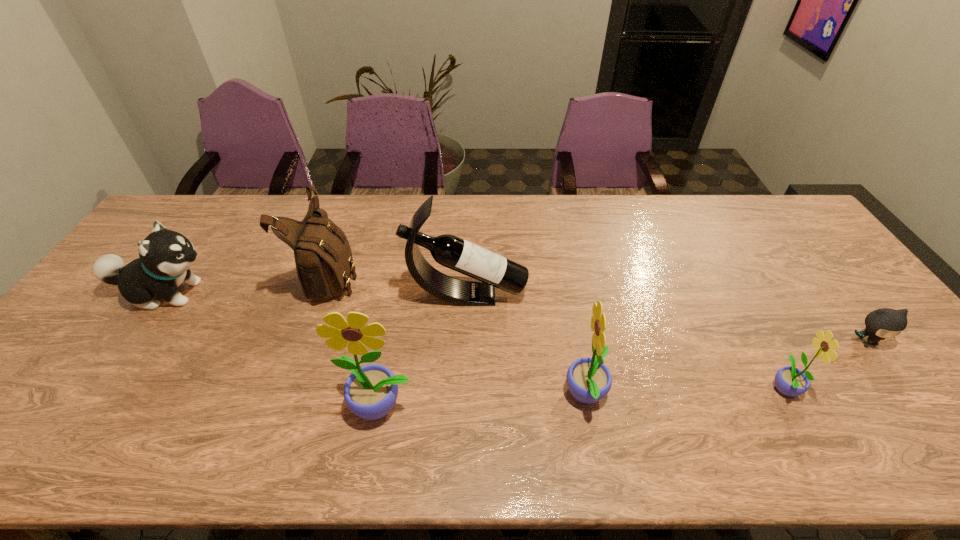
The image size is (960, 540). I want to click on free space between the leftmost object and the leftmost sunflower, so (275, 349).

Image resolution: width=960 pixels, height=540 pixels. I want to click on free space between the second object from left to right and the second shortest sunflower, so click(x=459, y=335).

This screenshot has width=960, height=540. Find the location of `the second closest object to the sixth object from left to right`. the second closest object to the sixth object from left to right is located at coordinates (589, 380).

Image resolution: width=960 pixels, height=540 pixels. I want to click on object that stands as the closest to the leftmost object, so click(x=323, y=257).

In order to click on sunflower that is the third closest to the sixth object from right to left in this screenshot , I will do `click(789, 380)`.

In order to click on sunflower that is the second closest to the leftmost object in this screenshot , I will do (589, 380).

This screenshot has height=540, width=960. I want to click on blank area in the image that satisfies the following two spatial constraints: 1. on the front-facing side of the shortest sunflower; 2. on the front-facing side of the leftmost sunflower, so click(x=794, y=406).

Identify the location of vacant space that satisfies the following two spatial constraints: 1. on the front-facing side of the kitten; 2. on the front-facing side of the sixth object from left to right. (900, 387).